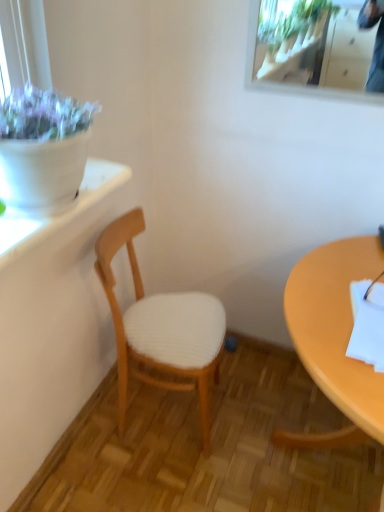
What do you see at coordinates (161, 327) in the screenshot?
I see `wooden chair at center` at bounding box center [161, 327].

Locate an element on the screen. wooden chair at center is located at coordinates (161, 327).

Where is `wooden chair at center`? This screenshot has width=384, height=512. wooden chair at center is located at coordinates (161, 327).

Does clear glass mirror at upper right appear on the right side of matte yellow desk at right?

No, clear glass mirror at upper right is not to the right of matte yellow desk at right.

Is the position of clear glass mirror at upper right less distant than that of matte yellow desk at right?

No, clear glass mirror at upper right is further to the viewer.

Is clear glass mirror at upper right facing towards matte yellow desk at right?

No, clear glass mirror at upper right is not facing towards matte yellow desk at right.

Does clear glass mirror at upper right have a larger size compared to matte yellow desk at right?

No, clear glass mirror at upper right is not bigger than matte yellow desk at right.

Would you say wooden chair at center is to the left or to the right of matte yellow desk at right in the picture?

Clearly, wooden chair at center is on the left of matte yellow desk at right in the image.

Could you tell me if wooden chair at center is turned towards matte yellow desk at right?

Yes, wooden chair at center faces towards matte yellow desk at right.

From a real-world perspective, is wooden chair at center physically above matte yellow desk at right?

Yes.

Considering the sizes of matte yellow desk at right and wooden chair at center in the image, is matte yellow desk at right wider or thinner than wooden chair at center?

matte yellow desk at right is wider than wooden chair at center.

Is there a large distance between matte yellow desk at right and wooden chair at center?

No, matte yellow desk at right is not far from wooden chair at center.

Looking at this image, is matte yellow desk at right inside the boundaries of wooden chair at center, or outside?

matte yellow desk at right is not inside wooden chair at center, it's outside.

Is matte yellow desk at right facing away from clear glass mirror at upper right?

No.

Which is correct: matte yellow desk at right is inside clear glass mirror at upper right, or outside of it?

matte yellow desk at right is outside clear glass mirror at upper right.

From their relative heights in the image, would you say matte yellow desk at right is taller or shorter than clear glass mirror at upper right?

In the image, matte yellow desk at right appears to be taller than clear glass mirror at upper right.

Is point (331, 379) positioned after point (323, 86)?

No, it is in front of (323, 86).

Is wooden chair at center positioned with its back to clear glass mirror at upper right?

That's not correct — wooden chair at center is not looking away from clear glass mirror at upper right.

Which is nearer, (159, 379) or (252, 58)?

The point (252, 58) is closer.

From the picture: Is wooden chair at center shorter than clear glass mirror at upper right?

Incorrect, the height of wooden chair at center does not fall short of that of clear glass mirror at upper right.

In the image, is wooden chair at center positioned in front of or behind clear glass mirror at upper right?

In the image, wooden chair at center appears in front of clear glass mirror at upper right.

Looking at their sizes, would you say clear glass mirror at upper right is wider or thinner than wooden chair at center?

Clearly, clear glass mirror at upper right has less width compared to wooden chair at center.

Is the position of clear glass mirror at upper right more distant than that of wooden chair at center?

Yes.

Is wooden chair at center surrounded by clear glass mirror at upper right?

No.

Is clear glass mirror at upper right aimed at wooden chair at center?

No.

Identify the location of desk on the right of clear glass mirror at upper right. Image resolution: width=384 pixels, height=512 pixels. (334, 339).

Where is `desk below the wooden chair at center (from the image's perspective)`? desk below the wooden chair at center (from the image's perspective) is located at coordinates (334, 339).

Based on their spatial positions, is wooden chair at center or clear glass mirror at upper right closer to matte yellow desk at right?

wooden chair at center.

When comparing their distances from wooden chair at center, does matte yellow desk at right or clear glass mirror at upper right seem further?

The object further to wooden chair at center is clear glass mirror at upper right.

From the image, which object appears to be farther from wooden chair at center, clear glass mirror at upper right or matte yellow desk at right?

clear glass mirror at upper right.

From the image, which object appears to be farther from clear glass mirror at upper right, matte yellow desk at right or wooden chair at center?

wooden chair at center lies further to clear glass mirror at upper right than the other object.

Based on their spatial positions, is clear glass mirror at upper right or wooden chair at center closer to matte yellow desk at right?

wooden chair at center.

Looking at the image, which one is located further to clear glass mirror at upper right, wooden chair at center or matte yellow desk at right?

wooden chair at center lies further to clear glass mirror at upper right than the other object.

Find the location of a particular element. chair between clear glass mirror at upper right and matte yellow desk at right vertically is located at coordinates (161, 327).